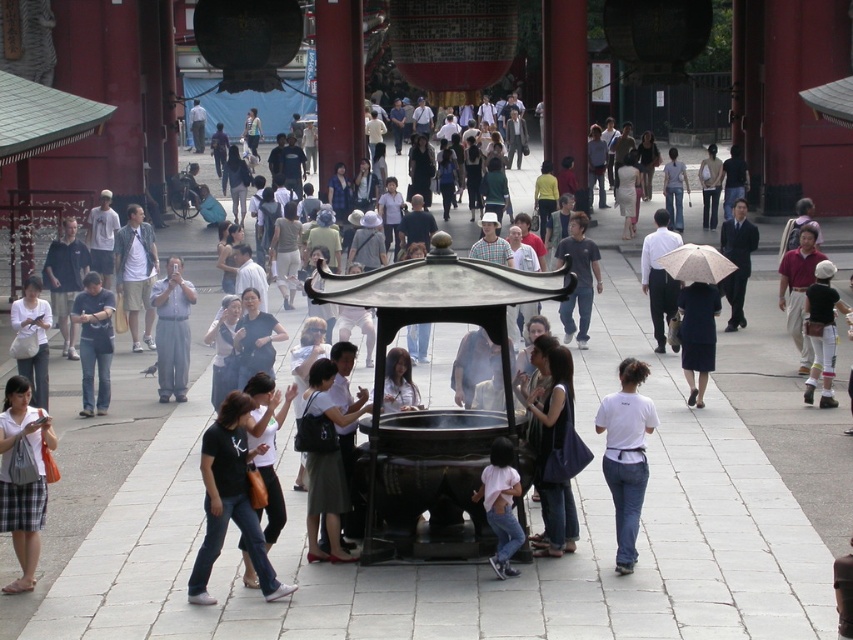
Is white fabric shirt at lower left positioned in front of pink fabric shirt at center?

That is True.

From the picture: Does white fabric shirt at lower left have a greater height compared to pink fabric shirt at center?

Correct, white fabric shirt at lower left is much taller as pink fabric shirt at center.

Is point (51, 474) farther from camera compared to point (505, 451)?

That is True.

You are a GUI agent. You are given a task and a screenshot of the screen. Output one action in this format:
    pyautogui.click(x=<x>, y=<y>)
    Task: Click on the white fabric shirt at lower left
    The height and width of the screenshot is (640, 853).
    Given the screenshot: What is the action you would take?
    pyautogui.click(x=22, y=476)

Who is positioned more to the left, denim jeans at left or pink fabric shirt at center?

denim jeans at left

Can you confirm if denim jeans at left is positioned to the left of pink fabric shirt at center?

Correct, you'll find denim jeans at left to the left of pink fabric shirt at center.

Is point (106, 374) behind point (495, 573)?

Yes, it is behind point (495, 573).

This screenshot has width=853, height=640. Find the location of `denim jeans at left`. denim jeans at left is located at coordinates (94, 340).

Consider the image. Who is lower down, black fabric shirt at center or white matte shirt at center?

black fabric shirt at center is lower down.

Who is taller, black fabric shirt at center or white matte shirt at center?

With more height is white matte shirt at center.

I want to click on black fabric shirt at center, so click(230, 500).